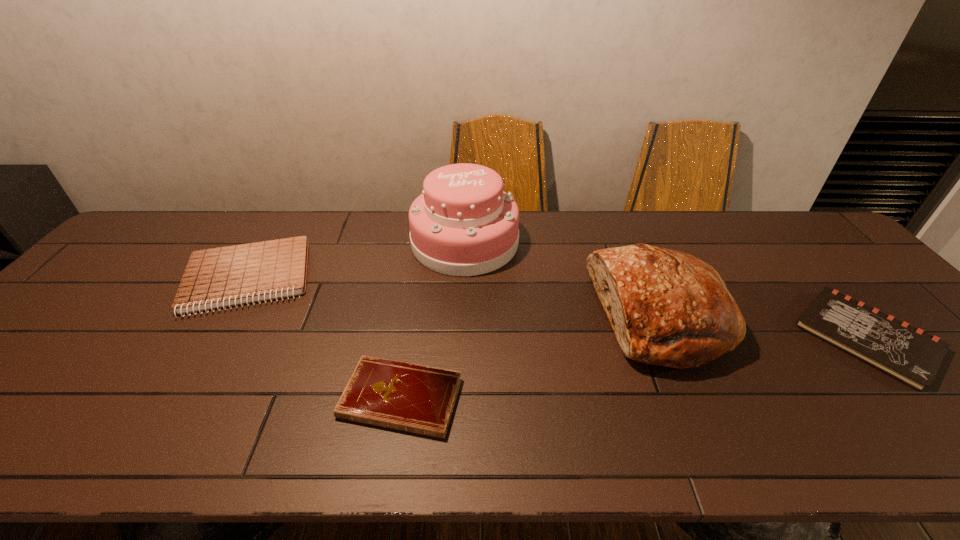
Where is `notebook that is the closest to the tallest notebook`? The width and height of the screenshot is (960, 540). notebook that is the closest to the tallest notebook is located at coordinates (420, 399).

Image resolution: width=960 pixels, height=540 pixels. I want to click on notebook that is the second closest to the shortest notebook, so click(910, 355).

I want to click on vacant area in the image that satisfies the following two spatial constraints: 1. on the front side of the shortest notebook; 2. on the right side of the leftmost object, so click(176, 398).